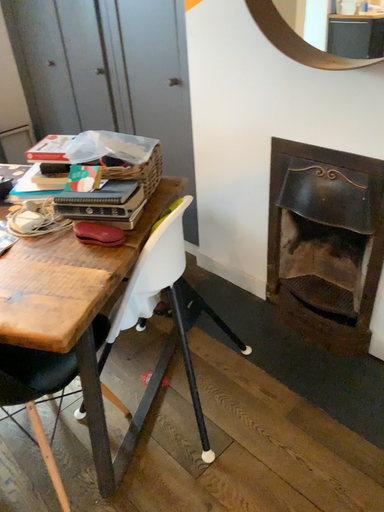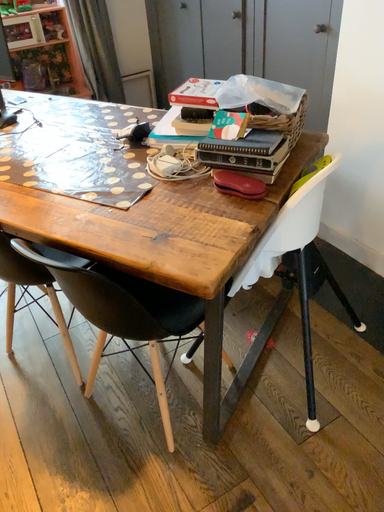
Question: Which way did the camera rotate in the video?

Choices:
 (A) rotated right
 (B) rotated left

Answer: (B)